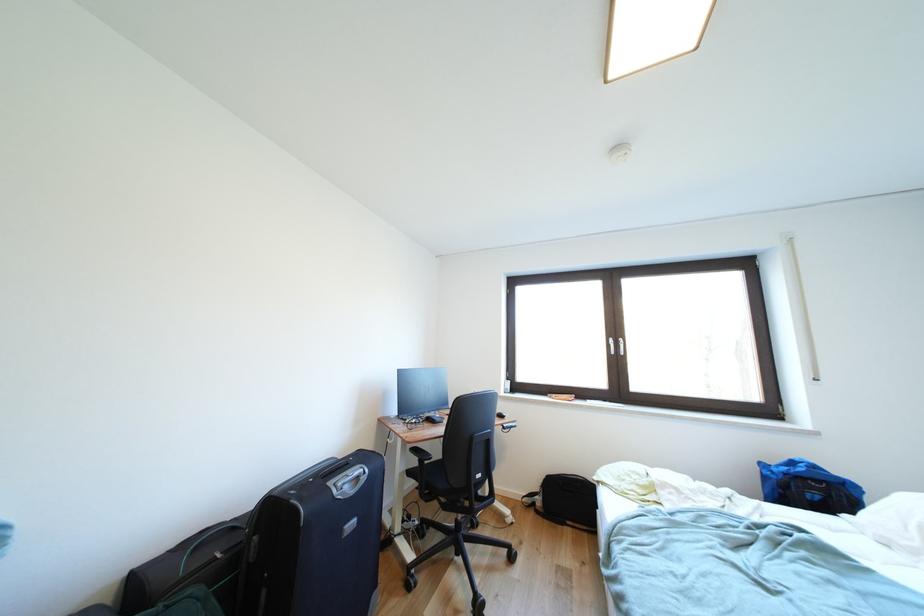
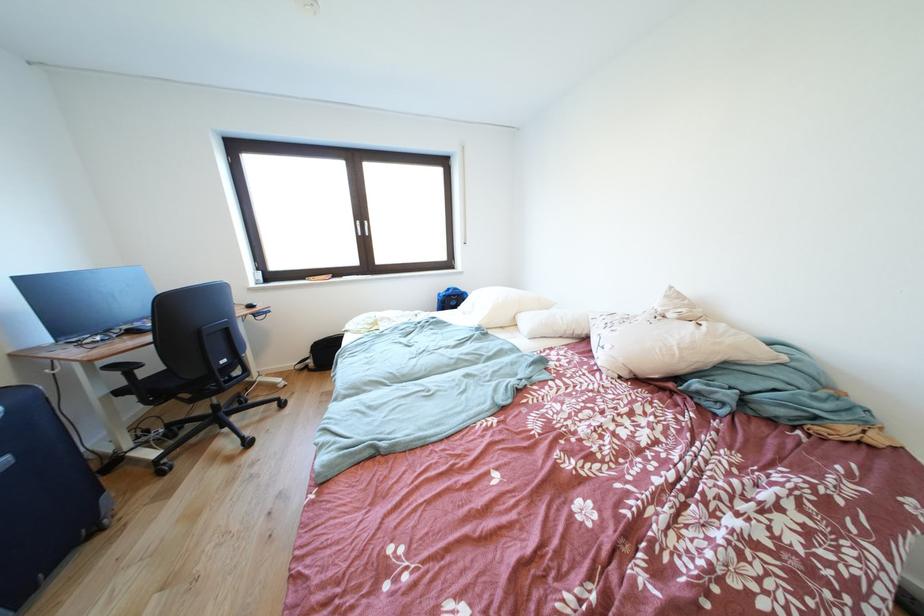
The point at (423, 455) is marked in the first image. Where is the corresponding point in the second image?

(120, 371)